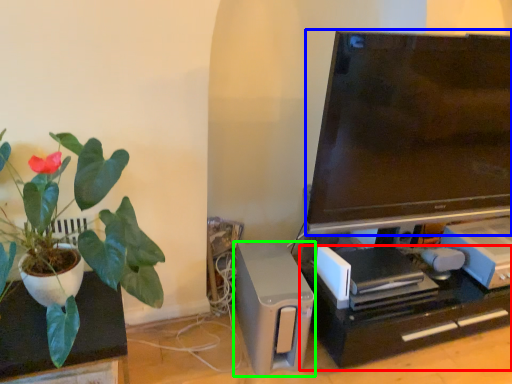
Question: Which object is the closest to the computer desk (highlighted by a red box)? Choose among these: television (highlighted by a blue box) or appliance (highlighted by a green box).

Choices:
 (A) television
 (B) appliance

Answer: (B)